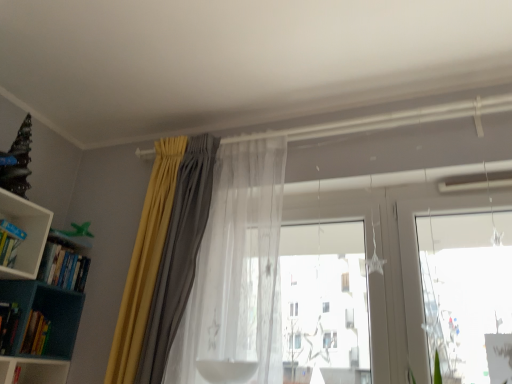
In order to face hardcover books at left, which is the 2th book from top to bottom, should I rotate leftwards or rightwards?

To align with it, rotate left about 26.221°.

What do you see at coordinates (163, 258) in the screenshot? I see `yellow fabric curtain at upper left, which ranks as the first curtain in left-to-right order` at bounding box center [163, 258].

This screenshot has width=512, height=384. What do you see at coordinates (8, 325) in the screenshot? I see `hardcover book at lower left, arranged as the 2th book when ordered from the bottom` at bounding box center [8, 325].

Identify the location of translucent sheer curtain at center, the first curtain positioned from the right. The width and height of the screenshot is (512, 384). (237, 268).

Locate an element on the screen. hardcover books at left, which is the 2th book from top to bottom is located at coordinates (63, 268).

Is translucent sheer curtain at center, which is the 2th curtain from left to right, in contact with translucent fabric at center?

No, translucent sheer curtain at center, which is the 2th curtain from left to right, is not touching translucent fabric at center.

Which is correct: translucent sheer curtain at center, the first curtain positioned from the right, is inside translucent fabric at center, or outside of it?

translucent sheer curtain at center, the first curtain positioned from the right, is located beyond the bounds of translucent fabric at center.

Is translucent sheer curtain at center, the first curtain positioned from the right, positioned with its back to translucent fabric at center?

Yes, translucent sheer curtain at center, the first curtain positioned from the right, is positioned with its back facing translucent fabric at center.

Is translucent sheer curtain at center, the first curtain positioned from the right, to the left of translucent fabric at center from the viewer's perspective?

Indeed, translucent sheer curtain at center, the first curtain positioned from the right, is positioned on the left side of translucent fabric at center.

Is translucent fabric at center taller or shorter than hardcover books at left, which is the 2th book from top to bottom?

Clearly, translucent fabric at center is taller compared to hardcover books at left, which is the 2th book from top to bottom.

From a real-world perspective, is translucent fabric at center physically located above or below hardcover books at left, which is the 2th book from top to bottom?

translucent fabric at center is situated lower than hardcover books at left, which is the 2th book from top to bottom, in the real world.

Is translucent fabric at center positioned with its back to hardcover books at left, which is the 2th book from top to bottom?

No, translucent fabric at center's orientation is not away from hardcover books at left, which is the 2th book from top to bottom.

Is translucent fabric at center positioned beyond the bounds of hardcover books at left, which is the 2th book from top to bottom?

translucent fabric at center lies outside hardcover books at left, which is the 2th book from top to bottom,'s area.

Based on their positions, is translucent fabric at center located to the left or right of hardcover books at left, marked as the 4th book in a top-to-bottom arrangement?

translucent fabric at center is positioned on hardcover books at left, marked as the 4th book in a top-to-bottom arrangement,'s right side.

Is translucent fabric at center smaller than hardcover books at left, marked as the 4th book in a top-to-bottom arrangement?

No, translucent fabric at center is not smaller than hardcover books at left, marked as the 4th book in a top-to-bottom arrangement.

Based on the photo, can you tell me how much translucent fabric at center and hardcover books at left, marked as the 4th book in a top-to-bottom arrangement, differ in facing direction?

translucent fabric at center and hardcover books at left, marked as the 4th book in a top-to-bottom arrangement, are facing 92 degrees away from each other.

Between translucent fabric at center and hardcover books at left, marked as the 4th book in a top-to-bottom arrangement, which one has larger width?

hardcover books at left, marked as the 4th book in a top-to-bottom arrangement, is wider.

Does yellow fabric curtain at upper left, the second curtain viewed from the right, come behind translucent sheer curtain at center, which is the 2th curtain from left to right?

Yes, yellow fabric curtain at upper left, the second curtain viewed from the right, is further from the viewer.

I want to click on curtain above the yellow fabric curtain at upper left, the second curtain viewed from the right (from the image's perspective), so click(237, 268).

Is yellow fabric curtain at upper left, the second curtain viewed from the right, wider than translucent sheer curtain at center, the first curtain positioned from the right?

Correct, the width of yellow fabric curtain at upper left, the second curtain viewed from the right, exceeds that of translucent sheer curtain at center, the first curtain positioned from the right.

Is yellow fabric curtain at upper left, the second curtain viewed from the right, positioned far away from translucent sheer curtain at center, which is the 2th curtain from left to right?

That's not correct — yellow fabric curtain at upper left, the second curtain viewed from the right, is a little close to translucent sheer curtain at center, which is the 2th curtain from left to right.

Does hardcover book at lower left, which is the 3th book in top-to-bottom order, lie behind hardcover books at left, marked as the 4th book in a top-to-bottom arrangement?

That is False.

Can you confirm if hardcover book at lower left, which is the 3th book in top-to-bottom order, is shorter than hardcover books at left, marked as the 4th book in a top-to-bottom arrangement?

Yes.

Are hardcover book at lower left, arranged as the 2th book when ordered from the bottom, and hardcover books at left, which is counted as the first book, starting from the bottom, far apart?

No, hardcover book at lower left, arranged as the 2th book when ordered from the bottom, is not far away from hardcover books at left, which is counted as the first book, starting from the bottom.

Is yellow fabric curtain at upper left, which ranks as the first curtain in left-to-right order, facing away from hardcover book at left, which is counted as the 1th book, starting from the top?

No, yellow fabric curtain at upper left, which ranks as the first curtain in left-to-right order, is not facing away from hardcover book at left, which is counted as the 1th book, starting from the top.

Can you confirm if yellow fabric curtain at upper left, the second curtain viewed from the right, is shorter than hardcover book at left, which is counted as the 1th book, starting from the top?

No.

Looking at this image, is hardcover book at left, which is counted as the 1th book, starting from the top, located within yellow fabric curtain at upper left, the second curtain viewed from the right?

That's incorrect, hardcover book at left, which is counted as the 1th book, starting from the top, is not inside yellow fabric curtain at upper left, the second curtain viewed from the right.

Who is more distant, yellow fabric curtain at upper left, the second curtain viewed from the right, or hardcover book at left, which is counted as the 1th book, starting from the top?

hardcover book at left, which is counted as the 1th book, starting from the top, is further from the camera.

Considering the sizes of objects translucent fabric at center and translucent sheer curtain at center, the first curtain positioned from the right, in the image provided, who is wider, translucent fabric at center or translucent sheer curtain at center, the first curtain positioned from the right,?

translucent sheer curtain at center, the first curtain positioned from the right, is wider.

You are a GUI agent. You are given a task and a screenshot of the screen. Output one action in this format:
    pyautogui.click(x=<x>, y=<y>)
    Task: Click on the 2nd curtain positioned above the translucent fabric at center (from a real-world perspective)
    
    Given the screenshot: What is the action you would take?
    pyautogui.click(x=237, y=268)

Considering the positions of point (317, 359) and point (255, 193), is point (317, 359) closer or farther from the camera than point (255, 193)?

Point (317, 359) is positioned closer to the camera compared to point (255, 193).

Which of these two, translucent fabric at center or translucent sheer curtain at center, which is the 2th curtain from left to right, is smaller?

translucent fabric at center is smaller.

What are the coordinates of `bay window that appears below the translucent sheer curtain at center, the first curtain positioned from the right (from a real-world perspective)` in the screenshot? It's located at (324, 301).

This screenshot has width=512, height=384. I want to click on bay window on the right side of hardcover books at left, which is the 3th book in bottom-to-top order, so click(324, 301).

When comparing their distances from yellow fabric curtain at upper left, the second curtain viewed from the right, does translucent sheer curtain at center, the first curtain positioned from the right, or hardcover books at left, which is the 3th book in bottom-to-top order, seem further?

hardcover books at left, which is the 3th book in bottom-to-top order, lies further to yellow fabric curtain at upper left, the second curtain viewed from the right, than the other object.

Which object lies further to the anchor point translucent fabric at center, yellow fabric curtain at upper left, which ranks as the first curtain in left-to-right order, or hardcover books at left, marked as the 4th book in a top-to-bottom arrangement?

hardcover books at left, marked as the 4th book in a top-to-bottom arrangement, is positioned further to the anchor translucent fabric at center.

Based on their spatial positions, is hardcover book at left, which is counted as the 1th book, starting from the top, or hardcover books at left, which is the 2th book from top to bottom, further from translucent sheer curtain at center, the first curtain positioned from the right?

hardcover book at left, which is counted as the 1th book, starting from the top, lies further to translucent sheer curtain at center, the first curtain positioned from the right, than the other object.

Looking at the image, which one is located further to hardcover book at lower left, arranged as the 2th book when ordered from the bottom, teal plastic bookcase at left or hardcover books at left, marked as the 4th book in a top-to-bottom arrangement?

teal plastic bookcase at left is further to hardcover book at lower left, arranged as the 2th book when ordered from the bottom.

Estimate the real-world distances between objects in this image. Which object is closer to hardcover book at lower left, which is the 3th book in top-to-bottom order, translucent sheer curtain at center, which is the 2th curtain from left to right, or yellow fabric curtain at upper left, the second curtain viewed from the right?

Among the two, yellow fabric curtain at upper left, the second curtain viewed from the right, is located nearer to hardcover book at lower left, which is the 3th book in top-to-bottom order.

Which object lies nearer to the anchor point hardcover books at left, which is the 2th book from top to bottom, teal plastic bookcase at left or hardcover books at left, which is counted as the first book, starting from the bottom?

Based on the image, teal plastic bookcase at left appears to be nearer to hardcover books at left, which is the 2th book from top to bottom.

When comparing their distances from translucent fabric at center, does teal plastic bookcase at left or hardcover books at left, marked as the 4th book in a top-to-bottom arrangement, seem closer?

teal plastic bookcase at left is positioned closer to the anchor translucent fabric at center.

From the image, which object appears to be nearer to hardcover book at lower left, which is the 3th book in top-to-bottom order, hardcover books at left, which is the 3th book in bottom-to-top order, or teal plastic bookcase at left?

teal plastic bookcase at left lies closer to hardcover book at lower left, which is the 3th book in top-to-bottom order, than the other object.

This screenshot has width=512, height=384. What are the coordinates of `book between hardcover books at left, which is the 2th book from top to bottom, and hardcover books at left, marked as the 4th book in a top-to-bottom arrangement, from top to bottom` in the screenshot? It's located at (8, 325).

The image size is (512, 384). In order to click on curtain located between hardcover book at left, which is counted as the 1th book, starting from the top, and translucent sheer curtain at center, the first curtain positioned from the right, in the left-right direction in this screenshot , I will do `click(163, 258)`.

I want to click on curtain between hardcover books at left, which is the 3th book in bottom-to-top order, and translucent sheer curtain at center, the first curtain positioned from the right, in the horizontal direction, so click(163, 258).

In order to click on book between hardcover book at left, arranged as the 4th book when ordered from the bottom, and hardcover book at lower left, arranged as the 2th book when ordered from the bottom, from top to bottom in this screenshot , I will do `click(63, 268)`.